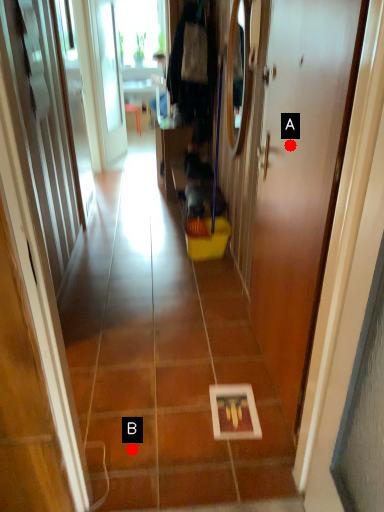
Question: Two points are circled on the image, labeled by A and B beside each circle. Which point appears farthest from the camera in this image?

Choices:
 (A) A is further
 (B) B is further

Answer: (B)